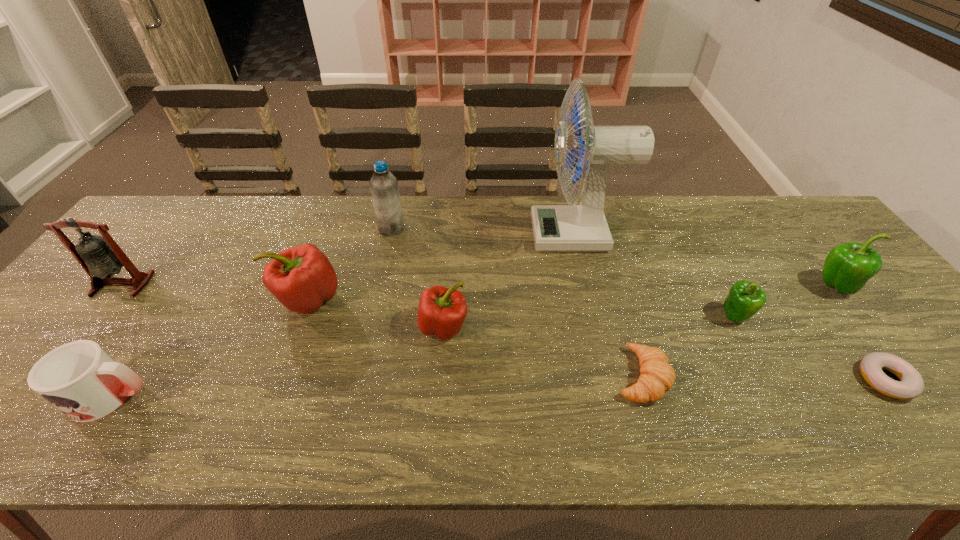
Find the location of a particular element. the third object from right to left is located at coordinates (745, 299).

Locate an element on the screen. the fifth object from left to right is located at coordinates point(441,311).

The height and width of the screenshot is (540, 960). In order to click on the smaller pink bell pepper in this screenshot , I will do `click(441, 311)`.

Identify the location of the ninth object from right to left. This screenshot has height=540, width=960. (79, 378).

You are a GUI agent. You are given a task and a screenshot of the screen. Output one action in this format:
    pyautogui.click(x=<x>, y=<y>)
    Task: Click on the second shortest object
    The height and width of the screenshot is (540, 960).
    Given the screenshot: What is the action you would take?
    pyautogui.click(x=657, y=376)

Find the location of a particular element. This screenshot has width=960, height=540. doughnut is located at coordinates (910, 385).

Find the location of a particular element. the shortest object is located at coordinates (910, 385).

Find the location of a particular element. This screenshot has height=540, width=960. free space located 0.390m on the front-facing side of the blue fan is located at coordinates (405, 234).

What are the coordinates of `vacant space located on the front-facing side of the blue fan` in the screenshot? It's located at (464, 234).

What are the coordinates of `free space located on the front-facing side of the blue fan` in the screenshot? It's located at (477, 234).